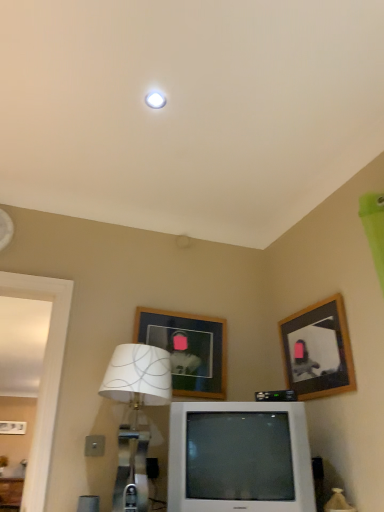
Question: Can you confirm if wooden picture frame at upper center, the first picture frame from the left, is smaller than wooden picture frame at upper right, which is counted as the second picture frame, starting from the left?

Choices:
 (A) no
 (B) yes

Answer: (B)

Question: From the image's perspective, is wooden picture frame at upper center, the first picture frame from the left, above wooden picture frame at upper right, which is counted as the second picture frame, starting from the left?

Choices:
 (A) no
 (B) yes

Answer: (A)

Question: Does wooden picture frame at upper center, the first picture frame from the left, have a lesser height compared to wooden picture frame at upper right, which is counted as the second picture frame, starting from the left?

Choices:
 (A) yes
 (B) no

Answer: (B)

Question: Considering the relative sizes of wooden picture frame at upper center, which appears as the 2th picture frame when viewed from the right, and wooden picture frame at upper right, which is counted as the second picture frame, starting from the left, in the image provided, is wooden picture frame at upper center, which appears as the 2th picture frame when viewed from the right, wider than wooden picture frame at upper right, which is counted as the second picture frame, starting from the left,?

Choices:
 (A) no
 (B) yes

Answer: (A)

Question: Is wooden picture frame at upper center, the first picture frame from the left, further to the viewer compared to wooden picture frame at upper right, the first picture frame from the right?

Choices:
 (A) no
 (B) yes

Answer: (B)

Question: Looking at their shapes, would you say wooden picture frame at upper center, which appears as the 2th picture frame when viewed from the right, is wider or thinner than white fabric lampshade at lower center?

Choices:
 (A) thin
 (B) wide

Answer: (A)

Question: Is point (213, 328) closer or farther from the camera than point (120, 476)?

Choices:
 (A) closer
 (B) farther

Answer: (B)

Question: Looking at the image, does wooden picture frame at upper center, the first picture frame from the left, seem bigger or smaller compared to white fabric lampshade at lower center?

Choices:
 (A) big
 (B) small

Answer: (B)

Question: Is wooden picture frame at upper center, which appears as the 2th picture frame when viewed from the right, to the left or to the right of white fabric lampshade at lower center in the image?

Choices:
 (A) left
 (B) right

Answer: (B)

Question: Considering the positions of white plastic television at center and wooden picture frame at upper center, which appears as the 2th picture frame when viewed from the right, in the image, is white plastic television at center taller or shorter than wooden picture frame at upper center, which appears as the 2th picture frame when viewed from the right,?

Choices:
 (A) short
 (B) tall

Answer: (B)

Question: Considering the positions of point (225, 430) and point (180, 342), is point (225, 430) closer or farther from the camera than point (180, 342)?

Choices:
 (A) farther
 (B) closer

Answer: (B)

Question: In the image, is white plastic television at center positioned in front of or behind wooden picture frame at upper center, which appears as the 2th picture frame when viewed from the right?

Choices:
 (A) behind
 (B) front

Answer: (B)

Question: From a real-world perspective, is white plastic television at center physically located above or below wooden picture frame at upper center, the first picture frame from the left?

Choices:
 (A) above
 (B) below

Answer: (B)

Question: Is white plastic television at center situated inside white fabric lampshade at lower center or outside?

Choices:
 (A) outside
 (B) inside

Answer: (A)

Question: From their relative heights in the image, would you say white plastic television at center is taller or shorter than white fabric lampshade at lower center?

Choices:
 (A) tall
 (B) short

Answer: (B)